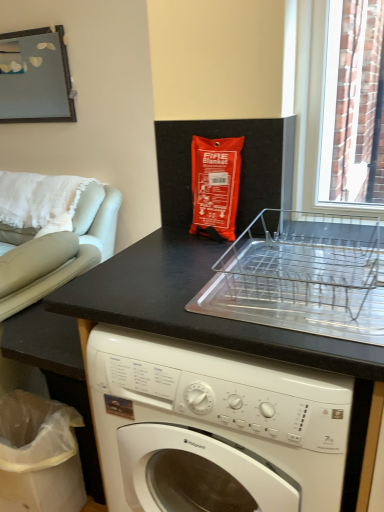
Question: Is light gray leather armchair at left wider than white cotton pillow at left?

Choices:
 (A) no
 (B) yes

Answer: (B)

Question: From a real-world perspective, is light gray leather armchair at left below white cotton pillow at left?

Choices:
 (A) no
 (B) yes

Answer: (B)

Question: Is light gray leather armchair at left aimed at white cotton pillow at left?

Choices:
 (A) yes
 (B) no

Answer: (B)

Question: Considering the relative sizes of light gray leather armchair at left and white cotton pillow at left in the image provided, is light gray leather armchair at left thinner than white cotton pillow at left?

Choices:
 (A) no
 (B) yes

Answer: (A)

Question: Can you confirm if light gray leather armchair at left is positioned to the left of white cotton pillow at left?

Choices:
 (A) no
 (B) yes

Answer: (B)

Question: Is the depth of light gray leather armchair at left greater than that of white cotton pillow at left?

Choices:
 (A) no
 (B) yes

Answer: (A)

Question: Does light gray leather armchair at left have a smaller size compared to black matte counter at lower left?

Choices:
 (A) yes
 (B) no

Answer: (B)

Question: Is the depth of light gray leather armchair at left greater than that of black matte counter at lower left?

Choices:
 (A) yes
 (B) no

Answer: (A)

Question: Considering the relative sizes of light gray leather armchair at left and black matte counter at lower left in the image provided, is light gray leather armchair at left shorter than black matte counter at lower left?

Choices:
 (A) no
 (B) yes

Answer: (B)

Question: From the image's perspective, would you say light gray leather armchair at left is shown under black matte counter at lower left?

Choices:
 (A) yes
 (B) no

Answer: (B)

Question: Can you confirm if light gray leather armchair at left is positioned to the left of black matte counter at lower left?

Choices:
 (A) no
 (B) yes

Answer: (B)

Question: Does light gray leather armchair at left contain black matte counter at lower left?

Choices:
 (A) no
 (B) yes

Answer: (A)

Question: Considering the relative positions of clear plastic dish rack at center and light gray leather armchair at left in the image provided, is clear plastic dish rack at center to the right of light gray leather armchair at left from the viewer's perspective?

Choices:
 (A) no
 (B) yes

Answer: (B)